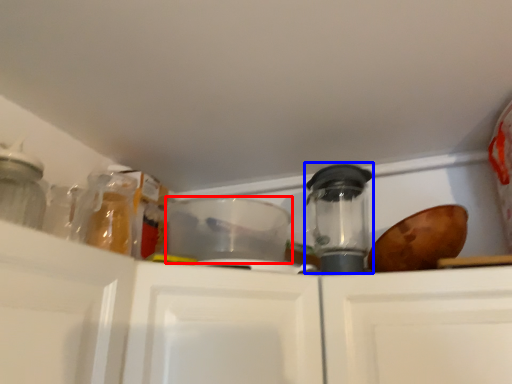
Question: Which of the following is the closest to the observer, appliance (highlighted by a red box) or appliance (highlighted by a blue box)?

Choices:
 (A) appliance
 (B) appliance

Answer: (A)